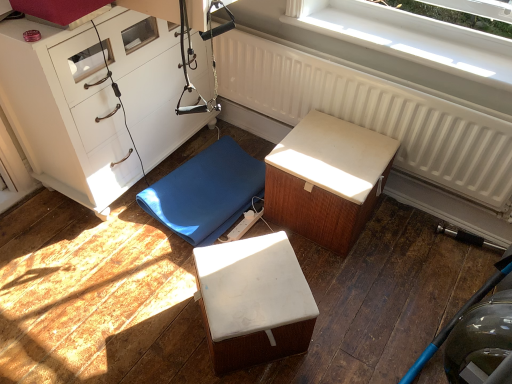
How much space does white textured cushion at center, which is the third furniture from left to right, occupy vertically?

It is 15.25 inches.

Measure the distance between point (431, 52) and camera.

They are 5.59 feet apart.

Measure the distance between point (446, 103) and camera.

1.63 meters.

At what (x,y) coordinates should I click in order to perform the action: click on white textured cushion at center, which is the third furniture from left to right. Please return your answer as a coordinate pair (x, y). Looking at the image, I should click on (327, 179).

Is white textured cushion at center, which ranks as the first furniture in right-to-left order, thinner than white textured radiator at upper center?

In fact, white textured cushion at center, which ranks as the first furniture in right-to-left order, might be wider than white textured radiator at upper center.

From the picture: From the image's perspective, between white textured cushion at center, which is the third furniture from left to right, and white textured radiator at upper center, who is located below?

white textured cushion at center, which is the third furniture from left to right, is shown below in the image.

How much distance is there between white textured cushion at center, which ranks as the first furniture in right-to-left order, and white textured radiator at upper center?

The distance of white textured cushion at center, which ranks as the first furniture in right-to-left order, from white textured radiator at upper center is 30.37 centimeters.

Which point is more distant from viewer, (499, 80) or (477, 153)?

The point (477, 153) is behind.

From a real-world perspective, is white plastic window at upper center positioned over white textured radiator at upper center based on gravity?

Correct, in the physical world, white plastic window at upper center is higher than white textured radiator at upper center.

Can you confirm if white plastic window at upper center is thinner than white textured radiator at upper center?

No, white plastic window at upper center is not thinner than white textured radiator at upper center.

From the image's perspective, is white plastic window at upper center located above or below white textured radiator at upper center?

From the image's perspective, white plastic window at upper center appears above white textured radiator at upper center.

Is the depth of white plastic window at upper center less than that of blue rubber mat at center, the third furniture when ordered from right to left?

Yes.

Is white plastic window at upper center at the left side of blue rubber mat at center, the third furniture when ordered from right to left?

Incorrect, white plastic window at upper center is not on the left side of blue rubber mat at center, the third furniture when ordered from right to left.

Which of these two, white plastic window at upper center or blue rubber mat at center, which is the first furniture from left to right, stands taller?

With more height is blue rubber mat at center, which is the first furniture from left to right.

From a real-world perspective, is white plastic window at upper center located higher than blue rubber mat at center, which is the first furniture from left to right?

Yes, from a real-world perspective, white plastic window at upper center is over blue rubber mat at center, which is the first furniture from left to right

Which object is positioned more to the left, white matte chest of drawers at left or blue rubber mat at center, the third furniture when ordered from right to left?

white matte chest of drawers at left.

Is point (146, 158) closer or farther from the camera than point (209, 171)?

Point (146, 158) is closer to the camera than point (209, 171).

Which object is thinner, white matte chest of drawers at left or blue rubber mat at center, which is the first furniture from left to right?

Thinner between the two is white matte chest of drawers at left.

Would you say white matte chest of drawers at left is outside blue rubber mat at center, the third furniture when ordered from right to left?

Indeed, white matte chest of drawers at left is completely outside blue rubber mat at center, the third furniture when ordered from right to left.

Does white matte cube at center, the 2th furniture in the right-to-left sequence, have a greater width compared to white plastic window at upper center?

Correct, the width of white matte cube at center, the 2th furniture in the right-to-left sequence, exceeds that of white plastic window at upper center.

From the picture: Is white matte cube at center, placed as the 2th furniture when sorted from left to right, not inside white plastic window at upper center?

Yes, white matte cube at center, placed as the 2th furniture when sorted from left to right, is not within white plastic window at upper center.

Considering the relative positions of white matte cube at center, placed as the 2th furniture when sorted from left to right, and white plastic window at upper center in the image provided, is white matte cube at center, placed as the 2th furniture when sorted from left to right, to the right of white plastic window at upper center from the viewer's perspective?

In fact, white matte cube at center, placed as the 2th furniture when sorted from left to right, is to the left of white plastic window at upper center.

Is white matte cube at center, the 2th furniture in the right-to-left sequence, with white plastic window at upper center?

They are not placed beside each other.

In the scene shown: How different are the orientations of white textured cushion at center, which is the third furniture from left to right, and white plastic window at upper center in degrees?

white textured cushion at center, which is the third furniture from left to right, and white plastic window at upper center are facing 0.537 degrees away from each other.

From the image's perspective, which one is positioned lower, white textured cushion at center, which is the third furniture from left to right, or white plastic window at upper center?

white textured cushion at center, which is the third furniture from left to right.

Between white textured cushion at center, which ranks as the first furniture in right-to-left order, and white plastic window at upper center, which one appears on the right side from the viewer's perspective?

From the viewer's perspective, white plastic window at upper center appears more on the right side.

Does white textured cushion at center, which is the third furniture from left to right, have a lesser width compared to white plastic window at upper center?

Incorrect, the width of white textured cushion at center, which is the third furniture from left to right, is not less than that of white plastic window at upper center.

Does white textured radiator at upper center touch white textured cushion at center, which is the third furniture from left to right?

No, white textured radiator at upper center is not beside white textured cushion at center, which is the third furniture from left to right.

Is white textured radiator at upper center closer to the viewer compared to white textured cushion at center, which ranks as the first furniture in right-to-left order?

Yes, white textured radiator at upper center is in front of white textured cushion at center, which ranks as the first furniture in right-to-left order.

Who is bigger, white textured radiator at upper center or white textured cushion at center, which ranks as the first furniture in right-to-left order?

With larger size is white textured cushion at center, which ranks as the first furniture in right-to-left order.

This screenshot has width=512, height=384. I want to click on radiator on the right of white textured cushion at center, which ranks as the first furniture in right-to-left order, so click(x=373, y=114).

In the image, there is a white plastic window at upper center. Where is `radiator below it (from the image's perspective)`? This screenshot has width=512, height=384. radiator below it (from the image's perspective) is located at coordinates (373, 114).

Estimate the real-world distances between objects in this image. Which object is closer to white textured cushion at center, which is the third furniture from left to right, white plastic window at upper center or white textured radiator at upper center?

white textured radiator at upper center is closer to white textured cushion at center, which is the third furniture from left to right.

From the image, which object appears to be nearer to white matte cube at center, placed as the 2th furniture when sorted from left to right, white matte chest of drawers at left or blue rubber mat at center, the third furniture when ordered from right to left?

Among the two, blue rubber mat at center, the third furniture when ordered from right to left, is located nearer to white matte cube at center, placed as the 2th furniture when sorted from left to right.

Based on their spatial positions, is white matte cube at center, placed as the 2th furniture when sorted from left to right, or white matte chest of drawers at left closer to blue rubber mat at center, the third furniture when ordered from right to left?

white matte chest of drawers at left.

Estimate the real-world distances between objects in this image. Which object is further from white matte chest of drawers at left, white plastic window at upper center or blue rubber mat at center, which is the first furniture from left to right?

white plastic window at upper center is further to white matte chest of drawers at left.

Considering their positions, is white matte chest of drawers at left positioned closer to white plastic window at upper center than white matte cube at center, the 2th furniture in the right-to-left sequence?

Among the two, white matte chest of drawers at left is located nearer to white plastic window at upper center.

Looking at the image, which one is located further to white matte cube at center, the 2th furniture in the right-to-left sequence, white plastic window at upper center or blue rubber mat at center, the third furniture when ordered from right to left?

Based on the image, white plastic window at upper center appears to be further to white matte cube at center, the 2th furniture in the right-to-left sequence.

Based on their spatial positions, is white matte chest of drawers at left or white textured radiator at upper center further from white plastic window at upper center?

white matte chest of drawers at left is further to white plastic window at upper center.

Estimate the real-world distances between objects in this image. Which object is further from white textured cushion at center, which is the third furniture from left to right, white plastic window at upper center or blue rubber mat at center, the third furniture when ordered from right to left?

Among the two, white plastic window at upper center is located further to white textured cushion at center, which is the third furniture from left to right.

The height and width of the screenshot is (384, 512). I want to click on furniture located between blue rubber mat at center, the third furniture when ordered from right to left, and white textured cushion at center, which is the third furniture from left to right, in the left-right direction, so click(x=254, y=301).

Image resolution: width=512 pixels, height=384 pixels. I want to click on radiator between white plastic window at upper center and white textured cushion at center, which ranks as the first furniture in right-to-left order, from top to bottom, so click(373, 114).

Identify the location of radiator between white matte chest of drawers at left and white plastic window at upper center from left to right. (373, 114).

The width and height of the screenshot is (512, 384). What are the coordinates of `radiator located between blue rubber mat at center, the third furniture when ordered from right to left, and white plastic window at upper center in the left-right direction` in the screenshot? It's located at (373, 114).